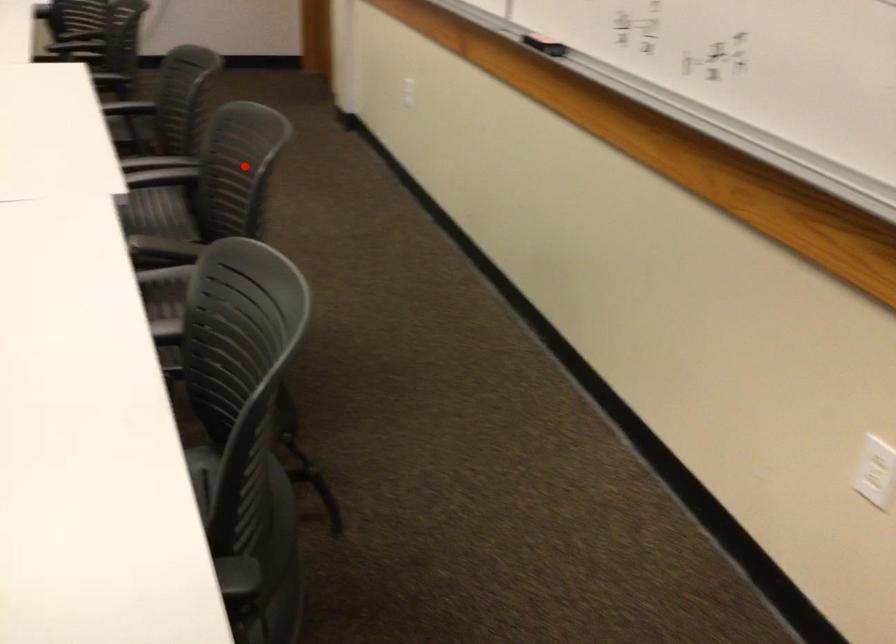
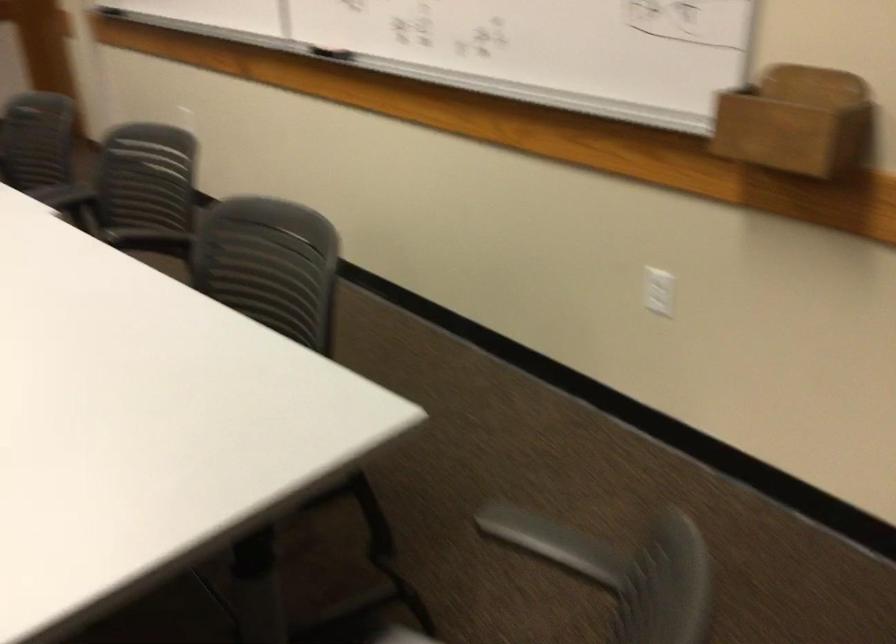
Find the pixel in the second image that matches the highlighted location in the first image.

(144, 178)